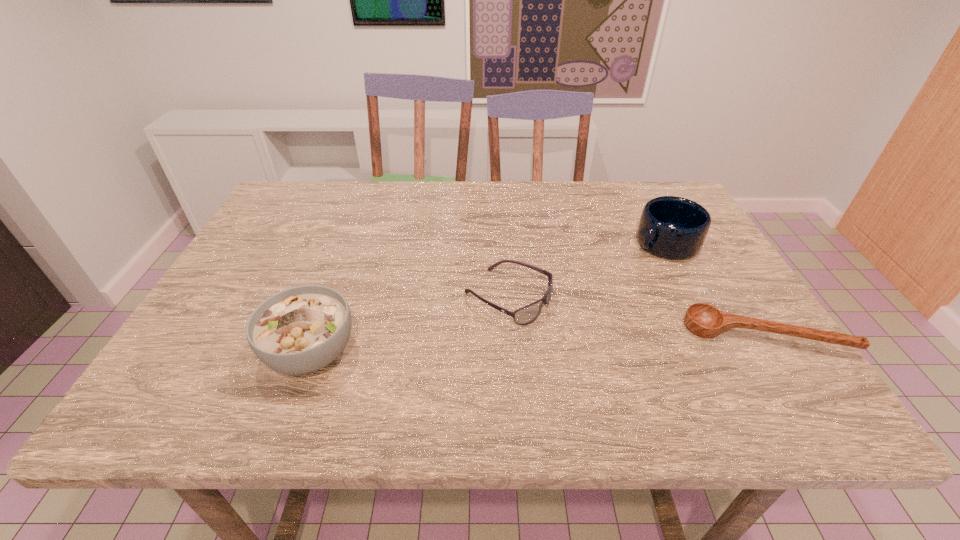
At what (x,y) coordinates should I click in order to perform the action: click on empty space between the mug and the wooden spoon. Please return your answer as a coordinate pair (x, y). The height and width of the screenshot is (540, 960). Looking at the image, I should click on (715, 289).

Locate an element on the screen. The width and height of the screenshot is (960, 540). free area in between the mug and the third tallest object is located at coordinates (587, 271).

I want to click on free space between the soup bowl and the mug, so click(489, 298).

Identify which object is the third nearest to the farthest object. Please provide its 2D coordinates. Your answer should be formatted as a tuple, i.e. [(x, y)], where the tuple contains the x and y coordinates of a point satisfying the conditions above.

[(299, 330)]

You are a GUI agent. You are given a task and a screenshot of the screen. Output one action in this format:
    pyautogui.click(x=<x>, y=<y>)
    Task: Click on the third closest object to the soup bowl
    The width and height of the screenshot is (960, 540).
    Given the screenshot: What is the action you would take?
    pyautogui.click(x=704, y=320)

The width and height of the screenshot is (960, 540). What are the coordinates of `vacant space that satisfies the following two spatial constraints: 1. on the front side of the sunglasses; 2. on the left side of the shortest object` in the screenshot? It's located at (511, 335).

Where is `free space that satisfies the following two spatial constraints: 1. on the back side of the leftmost object; 2. on the right side of the third object from right to left`? This screenshot has width=960, height=540. free space that satisfies the following two spatial constraints: 1. on the back side of the leftmost object; 2. on the right side of the third object from right to left is located at coordinates (331, 298).

Identify the location of blank area in the image that satisfies the following two spatial constraints: 1. on the back side of the soup bowl; 2. on the right side of the shortest object. This screenshot has width=960, height=540. (318, 335).